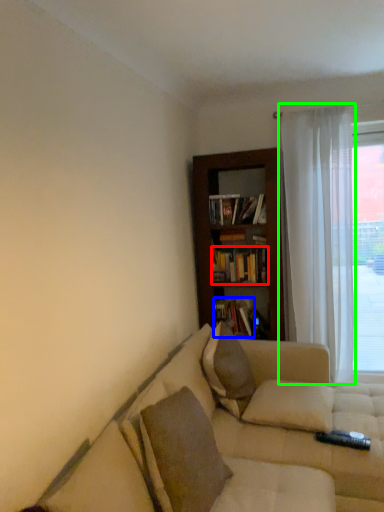
Question: Estimate the real-world distances between objects in this image. Which object is closer to book (highlighted by a red box), book (highlighted by a blue box) or curtain (highlighted by a green box)?

Choices:
 (A) book
 (B) curtain

Answer: (A)